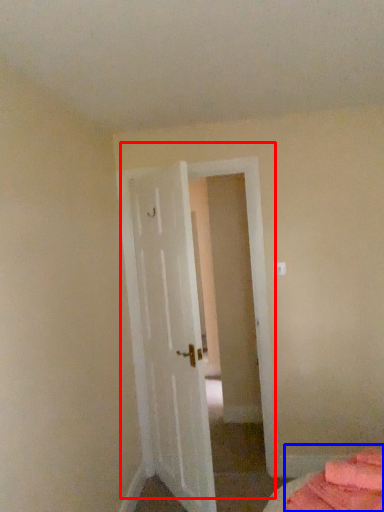
Question: Among these objects, which one is farthest to the camera, door (highlighted by a red box) or bed (highlighted by a blue box)?

Choices:
 (A) door
 (B) bed

Answer: (A)